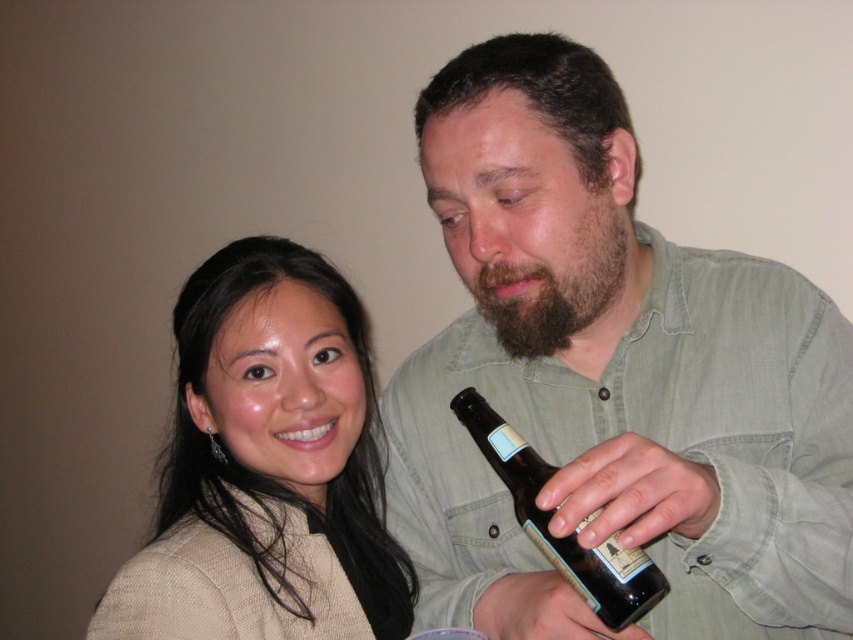
You are a photographer taking a portrait of the two people in the image. You want to ensure that the brown fuzzy beard at center is visible in the photo without being blocked by the brown matte bottle at center. Based on their positions, is this possible?

The brown matte bottle at center is positioned under the brown fuzzy beard at center, so the beard is above the bottle. This means the beard will not be blocked by the bottle, so yes, it should be visible in the photo.

You are a photographer who needs to capture both the brown matte bottle at center and the brown fuzzy beard at center in a single frame. Since the camera has a limited focus area, which object should you prioritize to ensure it fits better in the frame?

The brown matte bottle at center is bigger than the brown fuzzy beard at center, so you should prioritize capturing the brown matte bottle at center to ensure it fits better in the frame.